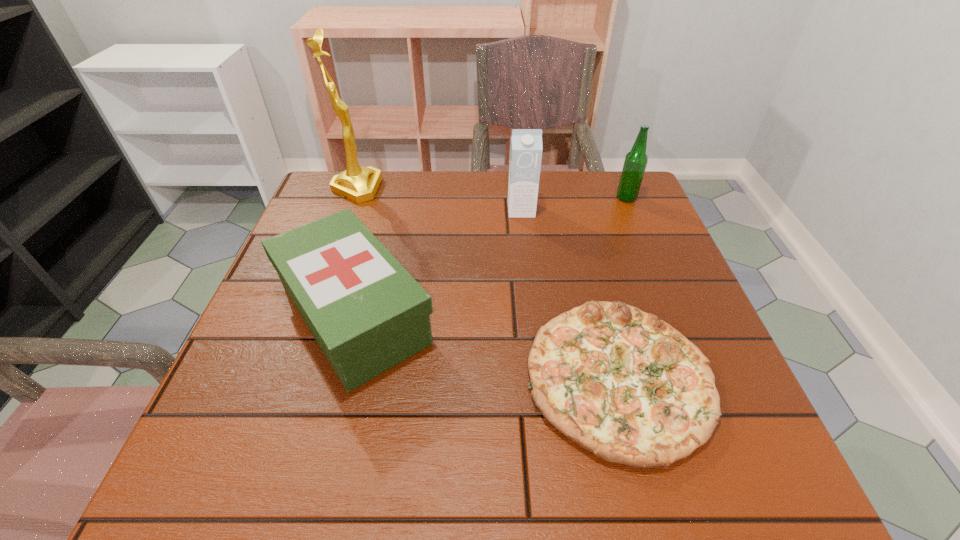
Locate an element on the screen. Image resolution: width=960 pixels, height=540 pixels. free point located 0.230m on the right of the second shortest object is located at coordinates (553, 315).

The height and width of the screenshot is (540, 960). In order to click on free space located 0.310m on the left of the pizza in this screenshot , I will do `click(352, 377)`.

Where is `award that is at the far edge`? Image resolution: width=960 pixels, height=540 pixels. award that is at the far edge is located at coordinates (359, 184).

Identify the location of carton at the far edge. The height and width of the screenshot is (540, 960). (526, 148).

This screenshot has width=960, height=540. What are the coordinates of `beer bottle that is at the far edge` in the screenshot? It's located at coord(636,160).

Find the location of a particular element. This screenshot has width=960, height=540. object that is positioned at the near edge is located at coordinates (629, 388).

This screenshot has width=960, height=540. Identify the location of award that is at the left edge. (359, 184).

This screenshot has width=960, height=540. I want to click on the first-aid kit that is at the left edge, so click(x=367, y=313).

At what (x,y) coordinates should I click in order to perform the action: click on beer bottle at the right edge. Please return your answer as a coordinate pair (x, y). The width and height of the screenshot is (960, 540). Looking at the image, I should click on (636, 160).

The height and width of the screenshot is (540, 960). I want to click on pizza situated at the right edge, so click(x=629, y=388).